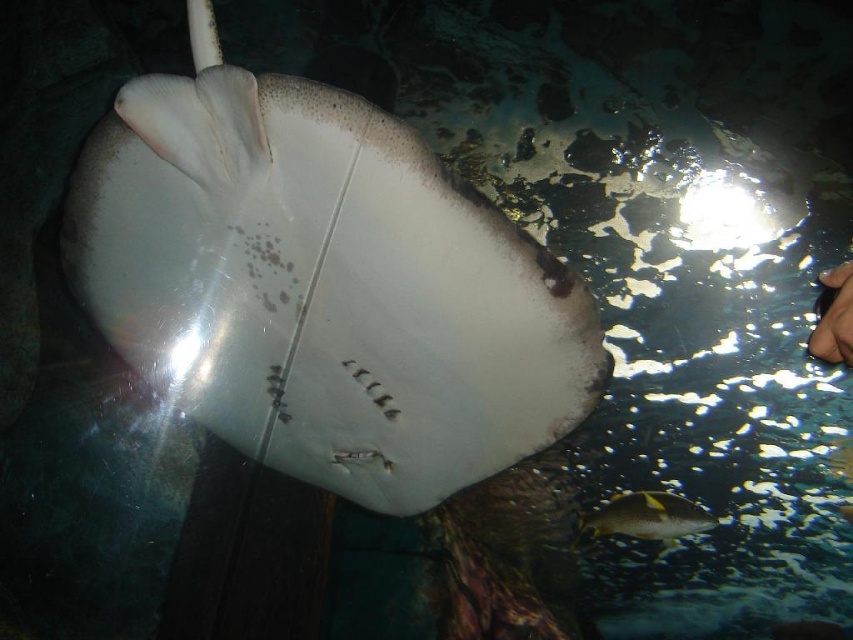
You are standing in front of an aquarium tank and see the white smooth stingray at center. If the tank is 5 feet wide, can you reach the stingray with a 1.5 feet long net?

The white smooth stingray at center and viewer are 4.89 feet apart. The net is 1.5 feet long, so you cannot reach the stingray with the net since the distance is greater than the net length.

You are an aquarium guide explaining the layout of the tank to a visitor. Pointing to the white smooth stingray at center, you want to describe its position relative to the tank walls. Since the tank is a rectangle, can you tell the visitor whether the stingray is closer to the left or right side of the tank?

The white smooth stingray at center is positioned at the center of the tank, so it is equidistant from both the left and right sides.